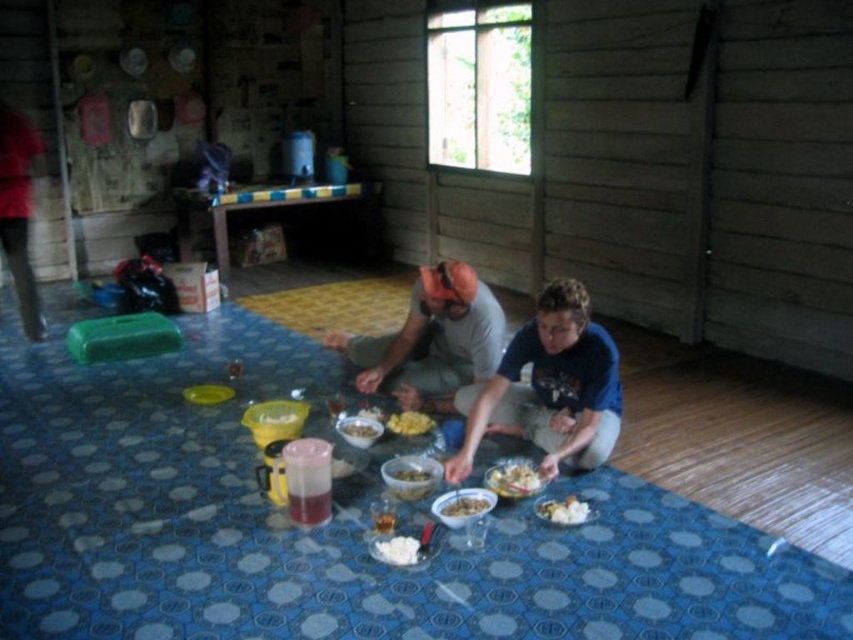
Question: Is white matte rice at lower center to the right of white fluffy rice at center from the viewer's perspective?

Choices:
 (A) yes
 (B) no

Answer: (A)

Question: Which is nearer to the wooden table at center?

Choices:
 (A) white matte bowl at center
 (B) shiny plastic bowl at center
 (C) smooth yellow bowl at center
 (D) yellow matte corn at center

Answer: (D)

Question: Can you confirm if white matte rice at lower center is bigger than yellow plastic bowl at center?

Choices:
 (A) no
 (B) yes

Answer: (B)

Question: Which object is positioned closest to the smooth yellow bowl at center?

Choices:
 (A) wooden table at center
 (B) white matte rice at center
 (C) yellow plastic bowl at center
 (D) white fluffy rice at center

Answer: (C)

Question: Among these points, which one is farthest from the camera?

Choices:
 (A) (396, 547)
 (B) (461, 502)

Answer: (B)

Question: Is blue cotton shirt at center wider than yellow plastic bowl at center?

Choices:
 (A) yes
 (B) no

Answer: (A)